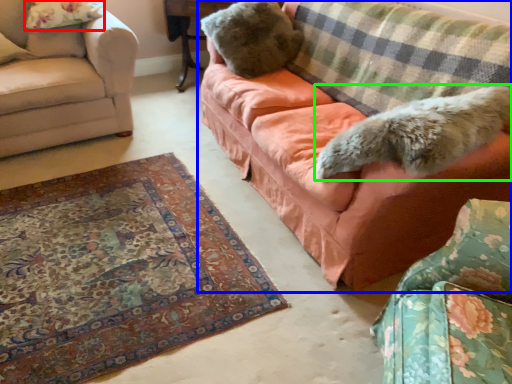
Question: Which object is positioned closest to pillow (highlighted by a red box)? Select from studio couch (highlighted by a blue box) and animal (highlighted by a green box).

Choices:
 (A) studio couch
 (B) animal

Answer: (A)